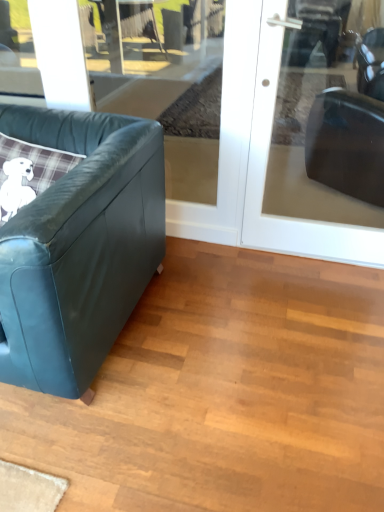
Question: Is leather couch at left at the right side of transparent glass door at upper left?

Choices:
 (A) yes
 (B) no

Answer: (B)

Question: Is leather couch at left not close to transparent glass door at upper left?

Choices:
 (A) yes
 (B) no

Answer: (A)

Question: Is leather couch at left smaller than transparent glass door at upper left?

Choices:
 (A) no
 (B) yes

Answer: (A)

Question: Is transparent glass door at upper left completely or partially inside leather couch at left?

Choices:
 (A) no
 (B) yes

Answer: (A)

Question: Is leather couch at left positioned with its back to transparent glass door at upper left?

Choices:
 (A) yes
 (B) no

Answer: (A)

Question: From a real-world perspective, relative to leather couch at left, is transparent glass door at upper right vertically above or below?

Choices:
 (A) below
 (B) above

Answer: (B)

Question: In terms of height, does transparent glass door at upper right look taller or shorter compared to leather couch at left?

Choices:
 (A) short
 (B) tall

Answer: (B)

Question: Considering their positions, is transparent glass door at upper right located in front of or behind leather couch at left?

Choices:
 (A) behind
 (B) front

Answer: (A)

Question: Is point (269, 9) closer or farther from the camera than point (79, 310)?

Choices:
 (A) farther
 (B) closer

Answer: (A)

Question: From the image's perspective, is leather couch at left located above or below transparent glass door at upper right?

Choices:
 (A) below
 (B) above

Answer: (A)

Question: Is leather couch at left taller or shorter than transparent glass door at upper right?

Choices:
 (A) tall
 (B) short

Answer: (B)

Question: Relative to transparent glass door at upper right, is leather couch at left in front or behind?

Choices:
 (A) behind
 (B) front

Answer: (B)

Question: Is leather couch at left wider or thinner than transparent glass door at upper right?

Choices:
 (A) wide
 (B) thin

Answer: (A)

Question: Is transparent glass door at upper left wider or thinner than leather couch at left?

Choices:
 (A) thin
 (B) wide

Answer: (A)

Question: Based on their sizes in the image, would you say transparent glass door at upper left is bigger or smaller than leather couch at left?

Choices:
 (A) small
 (B) big

Answer: (A)